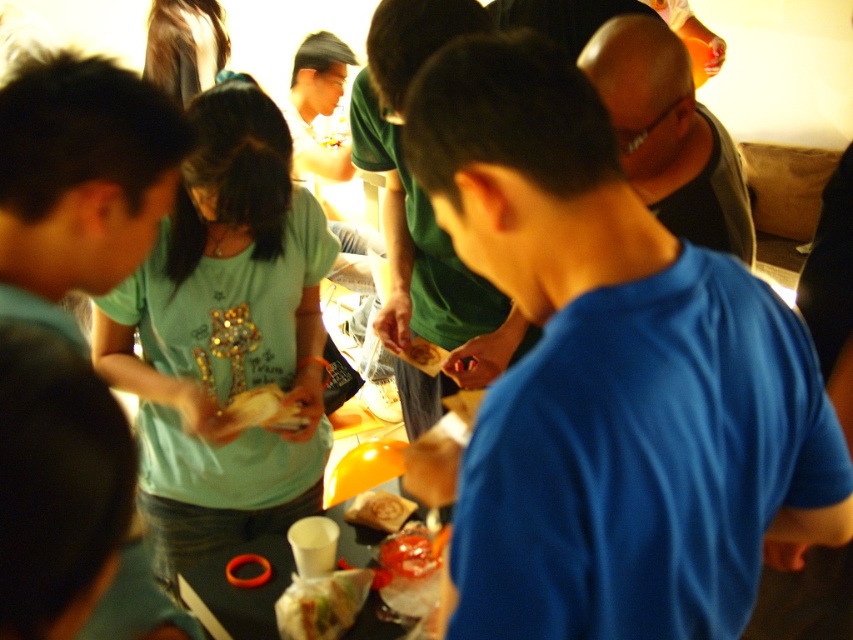
You are at a party and want to know if the blue smooth shirt at center can be used to cover the smooth plastic snack at center. Based on their sizes, is this possible?

The blue smooth shirt at center is wider than the smooth plastic snack at center, so it can be used to cover the smooth plastic snack at center.

You are at the point marked as point (x=669, y=134) in the image. What is the nearest object to you?

The nearest object to you at point (x=669, y=134) is the black matte tank top at upper right.